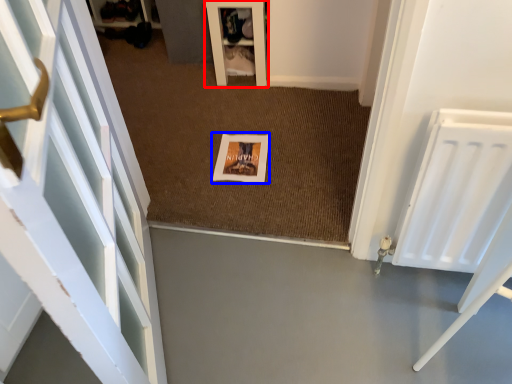
Question: Which object appears farthest to the camera in this image, furniture (highlighted by a red box) or picture frame (highlighted by a blue box)?

Choices:
 (A) furniture
 (B) picture frame

Answer: (A)